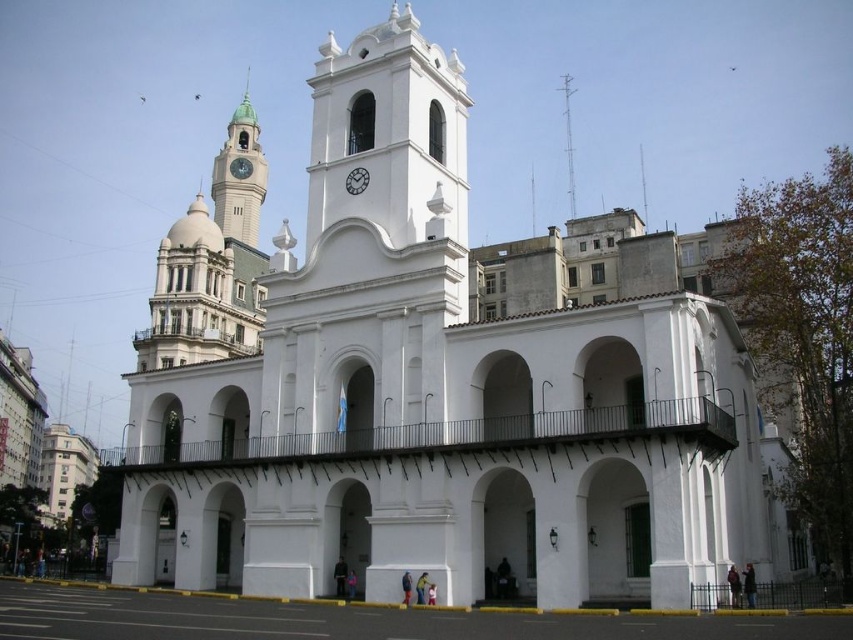
Does green glass clock tower at upper left have a larger size compared to metallic clock face at center?

Indeed, green glass clock tower at upper left has a larger size compared to metallic clock face at center.

Who is taller, green glass clock tower at upper left or metallic clock face at center?

Standing taller between the two is green glass clock tower at upper left.

You are a GUI agent. You are given a task and a screenshot of the screen. Output one action in this format:
    pyautogui.click(x=<x>, y=<y>)
    Task: Click on the green glass clock tower at upper left
    Image resolution: width=853 pixels, height=640 pixels.
    Given the screenshot: What is the action you would take?
    pyautogui.click(x=239, y=177)

At what (x,y) coordinates should I click in order to perform the action: click on green glass clock tower at upper left. Please return your answer as a coordinate pair (x, y). Image resolution: width=853 pixels, height=640 pixels. Looking at the image, I should click on (239, 177).

Is white smooth clock tower at center below smooth white spire at upper center?

Yes, white smooth clock tower at center is below smooth white spire at upper center.

Is point (337, 205) positioned before point (643, 164)?

Yes.

Is point (383, 208) positioned behind point (647, 224)?

No, (383, 208) is closer to viewer.

Where is `white smooth clock tower at center`? The image size is (853, 640). white smooth clock tower at center is located at coordinates (389, 134).

Between green glass clock tower at upper left and white matte clock at center, which one appears on the left side from the viewer's perspective?

From the viewer's perspective, green glass clock tower at upper left appears more on the left side.

Is point (236, 218) farther from viewer compared to point (360, 176)?

Yes, it is behind point (360, 176).

Identify the location of green glass clock tower at upper left. The height and width of the screenshot is (640, 853). (239, 177).